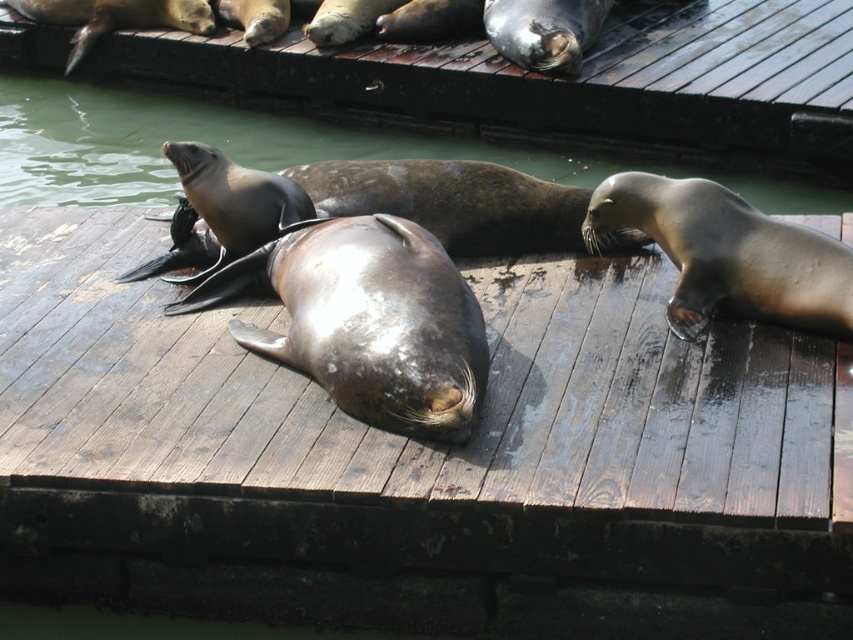
Question: Which point is closer to the camera?

Choices:
 (A) glossy water at center
 (B) dark brown wooden dock at center

Answer: (B)

Question: Does dark brown wooden dock at center lie behind glossy water at center?

Choices:
 (A) no
 (B) yes

Answer: (A)

Question: Which object appears closest to the camera in this image?

Choices:
 (A) glossy water at center
 (B) dark brown wooden dock at center

Answer: (B)

Question: Is the position of dark brown wooden dock at center more distant than that of glossy water at center?

Choices:
 (A) yes
 (B) no

Answer: (B)

Question: Which of the following is the closest to the observer?

Choices:
 (A) (218, 422)
 (B) (146, 140)

Answer: (A)

Question: Is dark brown wooden dock at center to the right of glossy water at center from the viewer's perspective?

Choices:
 (A) yes
 (B) no

Answer: (A)